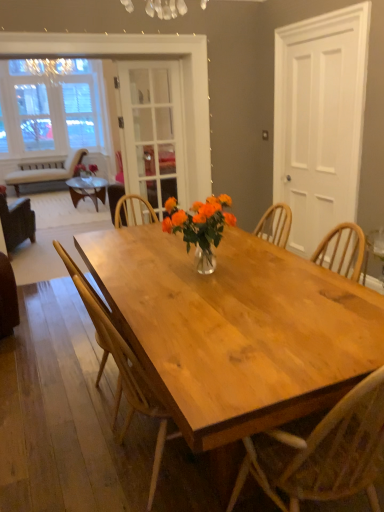
Question: Does translucent glass vase at center have a larger size compared to white matte door at right, placed as the first screen door when sorted from right to left?

Choices:
 (A) no
 (B) yes

Answer: (A)

Question: Are translucent glass vase at center and white matte door at right, placed as the first screen door when sorted from right to left, beside each other?

Choices:
 (A) yes
 (B) no

Answer: (B)

Question: Does translucent glass vase at center have a greater height compared to white matte door at right, placed as the first screen door when sorted from right to left?

Choices:
 (A) no
 (B) yes

Answer: (A)

Question: From the image's perspective, is translucent glass vase at center below white matte door at right, acting as the second screen door starting from the left?

Choices:
 (A) yes
 (B) no

Answer: (A)

Question: Is translucent glass vase at center shorter than white matte door at right, acting as the second screen door starting from the left?

Choices:
 (A) yes
 (B) no

Answer: (A)

Question: Is white matte door at right, acting as the second screen door starting from the left, at the back of translucent glass vase at center?

Choices:
 (A) yes
 (B) no

Answer: (B)

Question: Is white matte door at right, acting as the second screen door starting from the left, at the left side of translucent glass vase at center?

Choices:
 (A) no
 (B) yes

Answer: (A)

Question: Is white matte door at right, placed as the first screen door when sorted from right to left, positioned far away from translucent glass vase at center?

Choices:
 (A) no
 (B) yes

Answer: (B)

Question: Could you tell me if white matte door at right, placed as the first screen door when sorted from right to left, is facing translucent glass vase at center?

Choices:
 (A) yes
 (B) no

Answer: (B)

Question: From a real-world perspective, is white matte door at right, acting as the second screen door starting from the left, on translucent glass vase at center?

Choices:
 (A) yes
 (B) no

Answer: (A)

Question: Is white matte door at right, placed as the first screen door when sorted from right to left, placed right next to translucent glass vase at center?

Choices:
 (A) yes
 (B) no

Answer: (B)

Question: Is white matte door at right, placed as the first screen door when sorted from right to left, outside of translucent glass vase at center?

Choices:
 (A) no
 (B) yes

Answer: (B)

Question: Considering the relative sizes of brown leather chair at left, the 3th chair when ordered from right to left, and natural wood chair at center, the 2th chair from the back, in the image provided, is brown leather chair at left, the 3th chair when ordered from right to left, bigger than natural wood chair at center, the 2th chair from the back,?

Choices:
 (A) no
 (B) yes

Answer: (B)